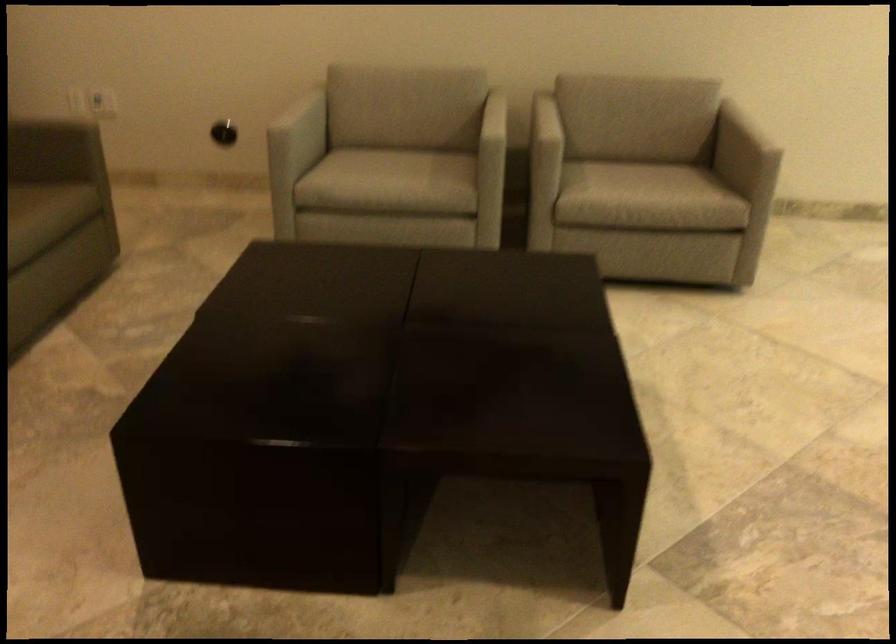
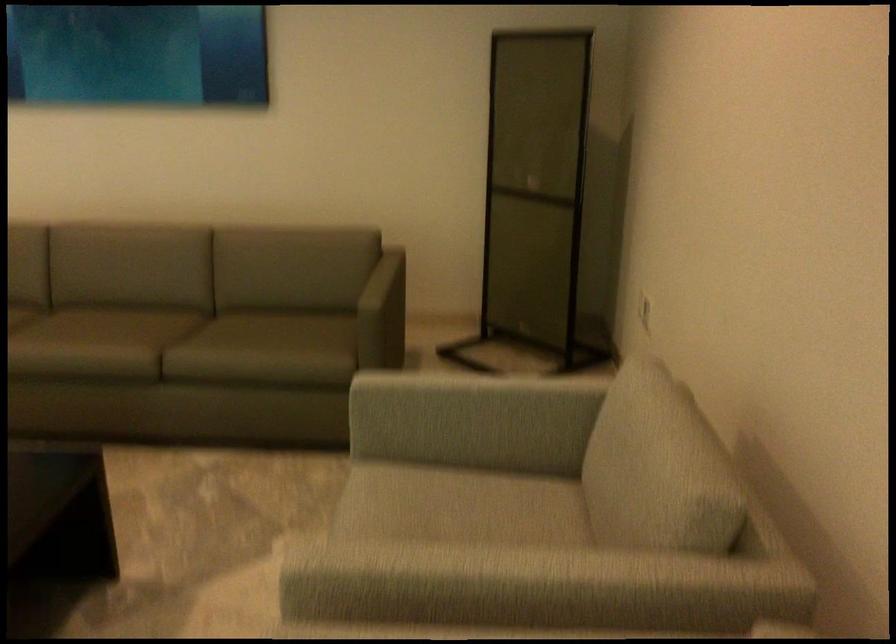
The point at (419,71) is marked in the first image. Where is the corresponding point in the second image?

(653, 451)